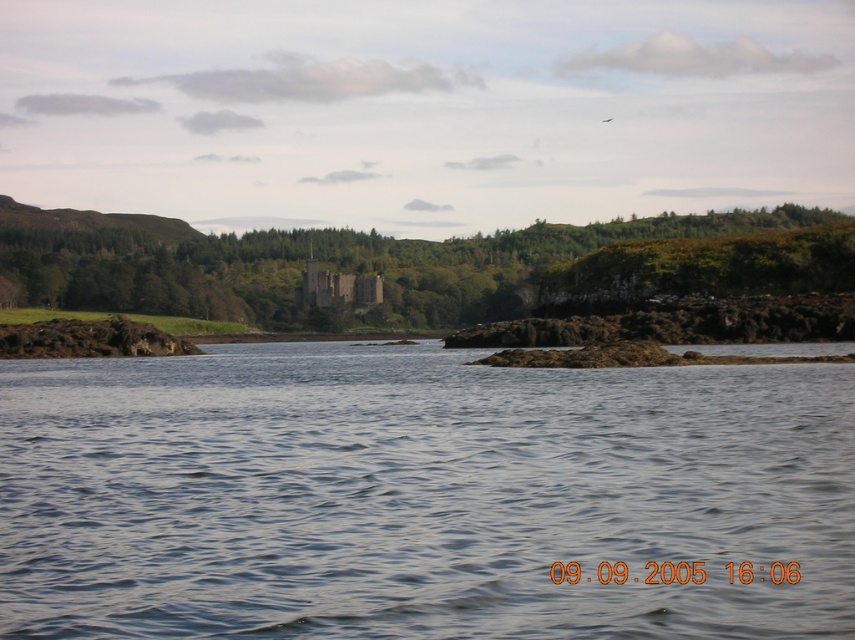
You are standing at the edge of the water and want to cross to the other side. The clear water at center is in your path. Based on its location, can you step over it directly without getting wet?

The clear water at center is located at point (419,497), which is directly in your path. Since it is water, you cannot step over it without getting wet.

You are standing at the edge of the water in the scene and notice both the clear water at center and the green leafy tree at center. Which object is closer to the water surface?

The clear water at center is located below the green leafy tree at center, so the clear water at center is closer to the water surface.

You are standing at the point with coordinates (419, 497) in the scene. What do you see around you?

You are standing at point (419, 497) where clear water at center is located. The surrounding area includes a serene landscape with a body of water reflecting an overcast sky, a rocky island in the midground, and a historic stone castle in the forested background.